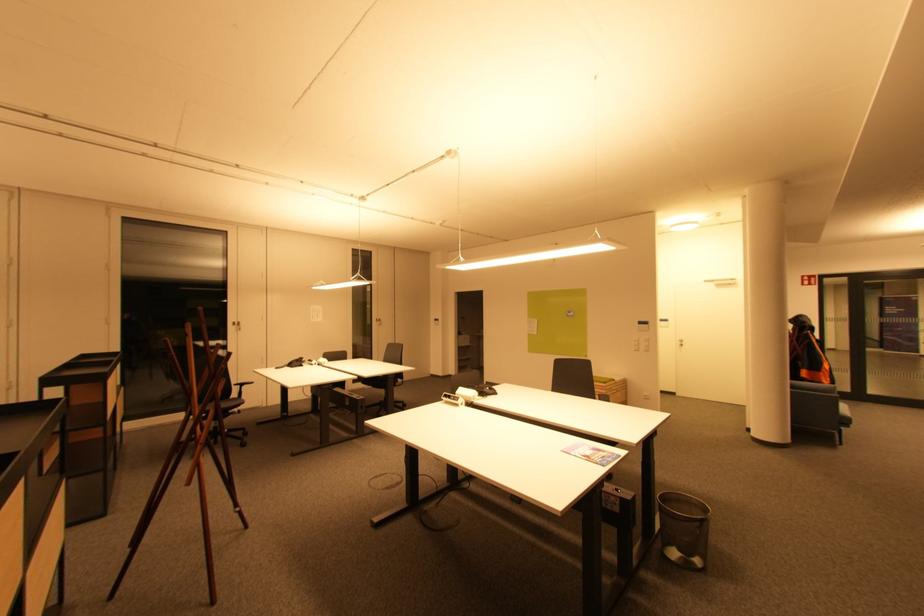
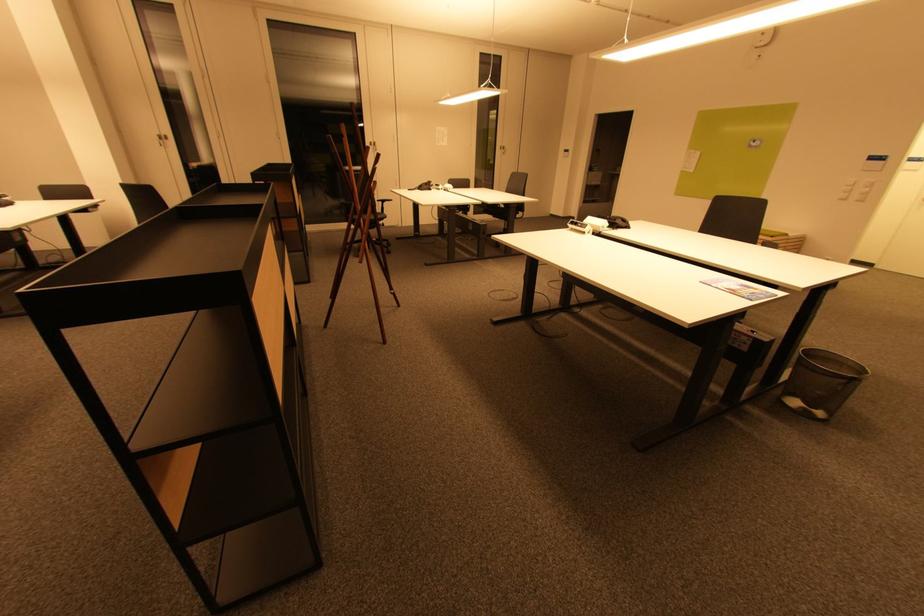
Find the pixel in the second image that matches pixel 403 377 in the first image.

(525, 209)